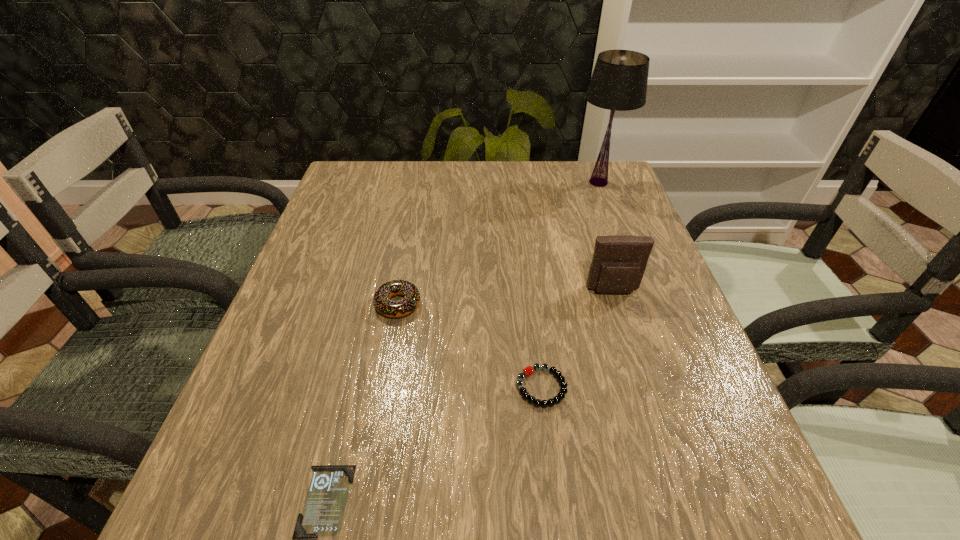
Where is `free space that satisfies the following two spatial constraints: 1. on the back side of the fourth tallest object; 2. on the right side of the shortest object`? The image size is (960, 540). free space that satisfies the following two spatial constraints: 1. on the back side of the fourth tallest object; 2. on the right side of the shortest object is located at coordinates (353, 387).

Image resolution: width=960 pixels, height=540 pixels. Identify the location of vacant region that satisfies the following two spatial constraints: 1. on the front-facing side of the farthest object; 2. with an open flap on the fourth shortest object. (639, 291).

Where is `vacant space that satisfies the following two spatial constraints: 1. on the front-facing side of the lampshade; 2. with an open flap on the pouch`? The image size is (960, 540). vacant space that satisfies the following two spatial constraints: 1. on the front-facing side of the lampshade; 2. with an open flap on the pouch is located at coordinates (639, 291).